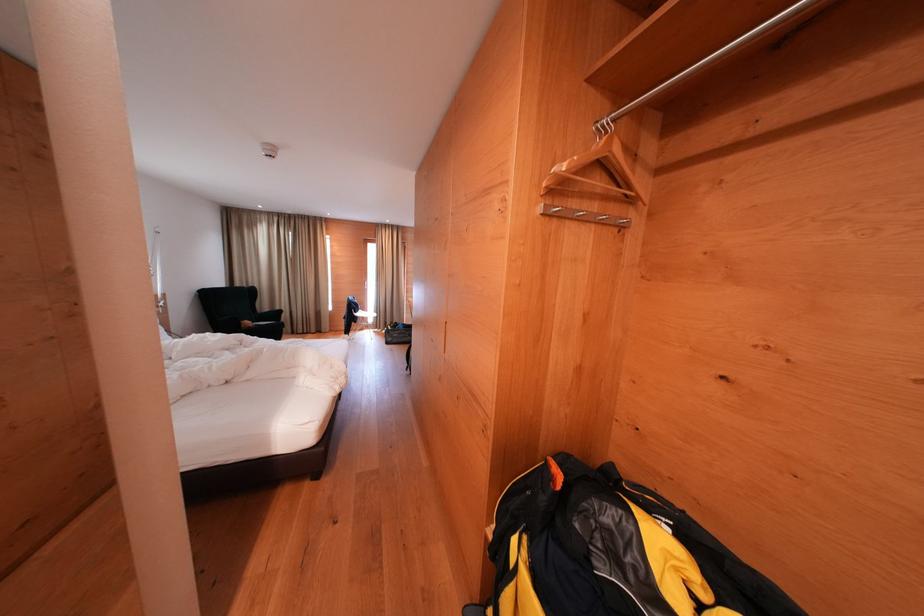
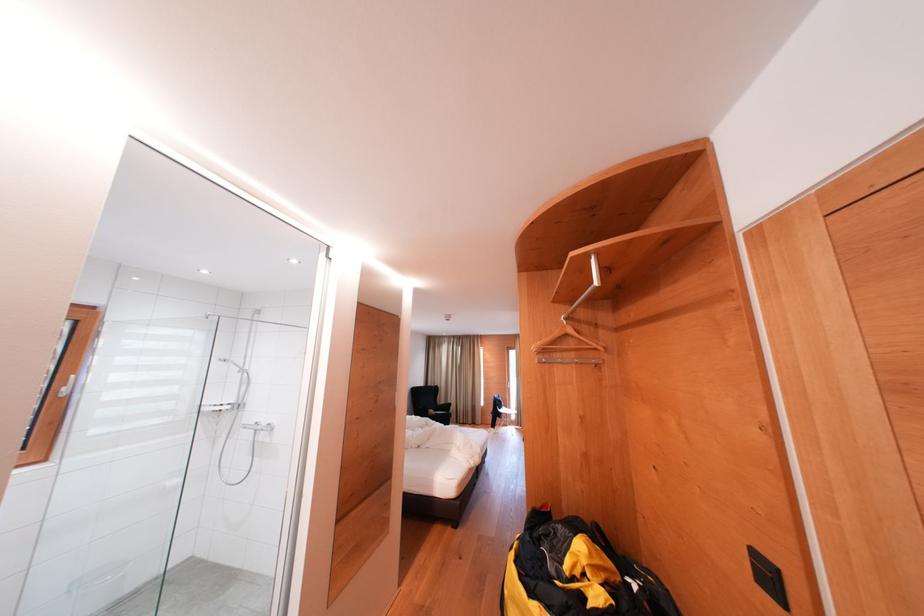
Where in the second image is the point corresponding to (254,328) from the first image?

(439, 416)